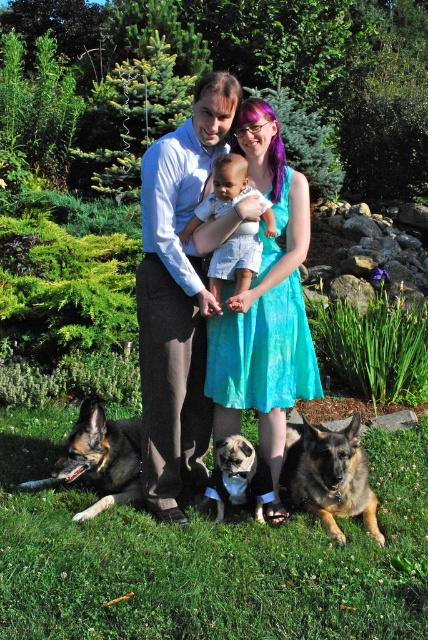
Question: Among these points, which one is farthest from the camera?

Choices:
 (A) (121, 435)
 (B) (216, 467)
 (C) (234, 244)

Answer: (A)

Question: Which of the following is the farthest from the observer?

Choices:
 (A) (247, 477)
 (B) (151, 378)
 (C) (321, 461)
 (D) (83, 520)

Answer: (A)

Question: Is light blue shirt at center to the right of brown fur dog at lower center from the viewer's perspective?

Choices:
 (A) no
 (B) yes

Answer: (A)

Question: Does green grass at center appear under light blue shirt at center?

Choices:
 (A) yes
 (B) no

Answer: (A)

Question: Does turquoise fabric dress at center appear under dark brown fur at lower left?

Choices:
 (A) yes
 (B) no

Answer: (B)

Question: Which point is farther to the camera?

Choices:
 (A) (291, 452)
 (B) (190, 404)

Answer: (A)